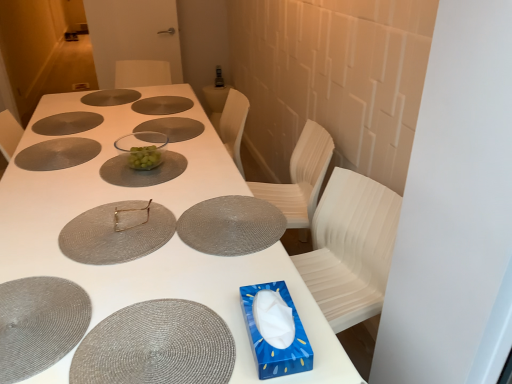
Locate an element on the screen. The width and height of the screenshot is (512, 384). free spot to the right of matte gray placemat at center, arranged as the second glass plate when viewed from the front is located at coordinates (212, 226).